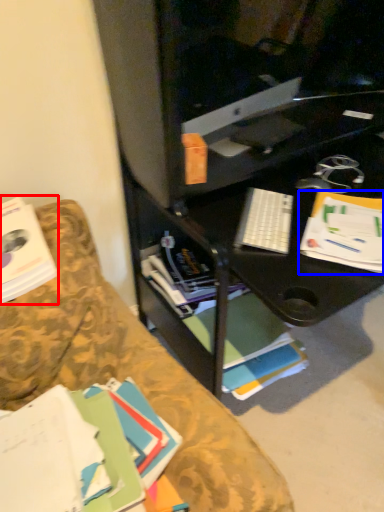
Question: Which of the following is the closest to the observer, book (highlighted by a red box) or paperback book (highlighted by a blue box)?

Choices:
 (A) book
 (B) paperback book

Answer: (A)